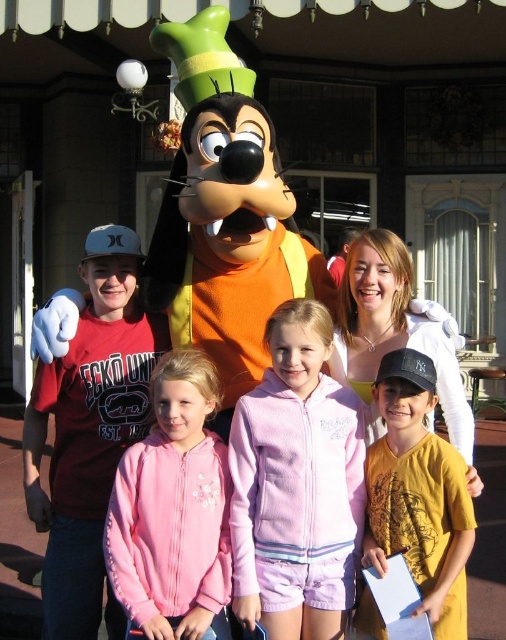
From the picture: Is pink fleece hoodie at center positioned before yellow cotton shirt at center?

No.

Which is below, pink fleece hoodie at center or yellow cotton shirt at center?

yellow cotton shirt at center is lower down.

Is point (292, 518) closer to viewer compared to point (451, 461)?

No, (292, 518) is further to viewer.

Locate an element on the screen. This screenshot has width=506, height=640. pink fleece hoodie at center is located at coordinates (297, 484).

Measure the distance between pink fleece jacket at center and camera.

pink fleece jacket at center is 10.65 meters from camera.

Can you confirm if pink fleece jacket at center is positioned below white cotton shirt at center?

Correct, pink fleece jacket at center is located below white cotton shirt at center.

What do you see at coordinates (173, 509) in the screenshot? I see `pink fleece jacket at center` at bounding box center [173, 509].

Find the location of a particular element. pink fleece jacket at center is located at coordinates (173, 509).

Does pink fleece jacket at center have a lesser height compared to yellow cotton shirt at center?

Incorrect, pink fleece jacket at center's height does not fall short of yellow cotton shirt at center's.

Who is more forward, (144, 493) or (403, 497)?

Positioned in front is point (403, 497).

What do you see at coordinates (173, 509) in the screenshot? I see `pink fleece jacket at center` at bounding box center [173, 509].

Where is `pink fleece jacket at center`? Image resolution: width=506 pixels, height=640 pixels. pink fleece jacket at center is located at coordinates (173, 509).